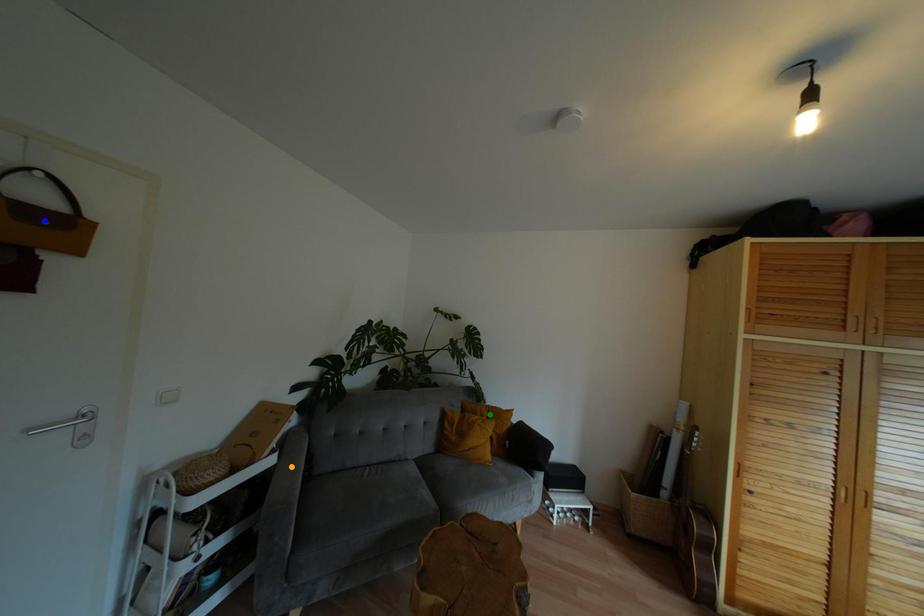
Order these from nearest to farthest:
- green point
- blue point
- orange point

blue point → orange point → green point